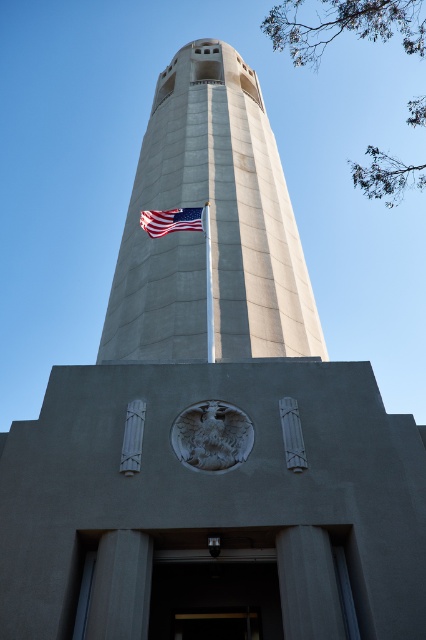
Is concrete tower at center positioned behind american flag at center?

No, it is not.

Between concrete tower at center and american flag at center, which one appears on the right side from the viewer's perspective?

concrete tower at center

Is point (258, 179) positioned behind point (164, 216)?

That is True.

Image resolution: width=426 pixels, height=640 pixels. Identify the location of concrete tower at center. (210, 227).

Where is `american flag at center`? The width and height of the screenshot is (426, 640). american flag at center is located at coordinates (172, 220).

The image size is (426, 640). Describe the element at coordinates (172, 220) in the screenshot. I see `american flag at center` at that location.

The width and height of the screenshot is (426, 640). I want to click on american flag at center, so click(172, 220).

Who is more forward, (261,259) or (207,355)?

Point (207,355) is more forward.

Can you confirm if concrete tower at center is positioned above white smooth flag pole at center?

Yes, concrete tower at center is above white smooth flag pole at center.

What do you see at coordinates (210, 227) in the screenshot?
I see `concrete tower at center` at bounding box center [210, 227].

Locate an element on the screen. Image resolution: width=426 pixels, height=640 pixels. concrete tower at center is located at coordinates (210, 227).